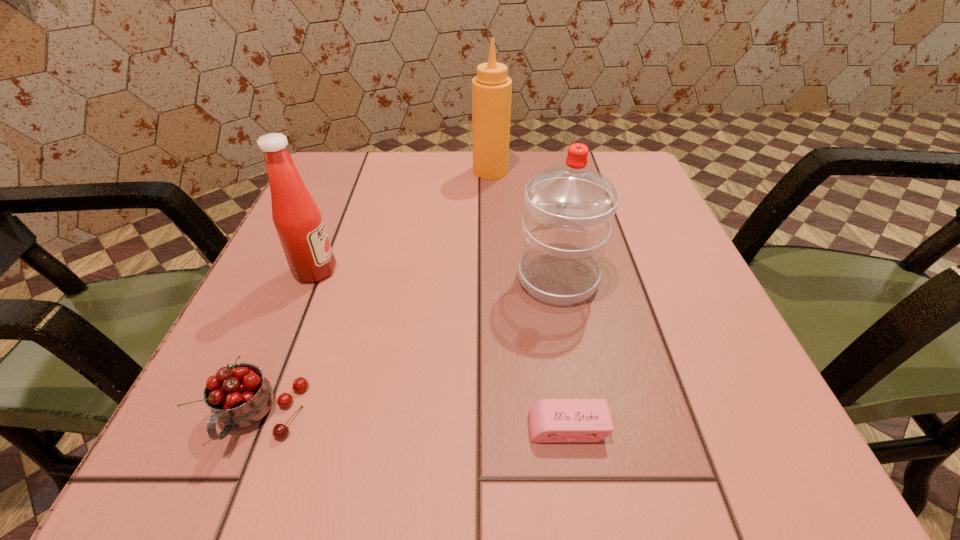
The image size is (960, 540). Identify the location of empty space between the water bottle and the second shortest object. (409, 347).

Identify which object is the third closest to the cherry. Please provide its 2D coordinates. Your answer should be formatted as a tuple, i.e. [(x, y)], where the tuple contains the x and y coordinates of a point satisfying the conditions above.

[(569, 209)]

Locate which object is the third closest to the left condiment. Please provide its 2D coordinates. Your answer should be formatted as a tuple, i.e. [(x, y)], where the tuple contains the x and y coordinates of a point satisfying the conditions above.

[(491, 88)]

Where is `blank space that satisfies the following two spatial constraints: 1. on the front side of the farther condiment; 2. on the front-facing side of the nearer condiment`? This screenshot has height=540, width=960. blank space that satisfies the following two spatial constraints: 1. on the front side of the farther condiment; 2. on the front-facing side of the nearer condiment is located at coordinates (493, 271).

Where is `free space that satisfies the following two spatial constraints: 1. on the handle side of the second shortest object; 2. on the left side of the shortest object`? free space that satisfies the following two spatial constraints: 1. on the handle side of the second shortest object; 2. on the left side of the shortest object is located at coordinates (255, 427).

You are a GUI agent. You are given a task and a screenshot of the screen. Output one action in this format:
    pyautogui.click(x=<x>, y=<y>)
    Task: Click on the free region that satisfies the following two spatial constraints: 1. on the front-facing side of the left condiment; 2. on the handle side of the water bottle
    
    Given the screenshot: What is the action you would take?
    pyautogui.click(x=312, y=279)

In order to click on vacant region that satisfies the following two spatial constraints: 1. on the front-facing side of the nearer condiment; 2. on the right side of the eraser in this screenshot , I will do `click(252, 427)`.

Locate an element on the screen. vacant space that satisfies the following two spatial constraints: 1. on the handle side of the eraser; 2. on the right side of the cherry is located at coordinates (255, 427).